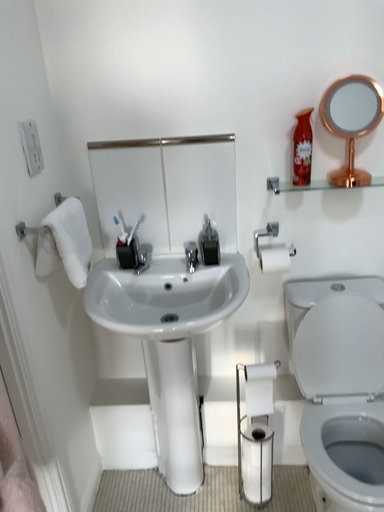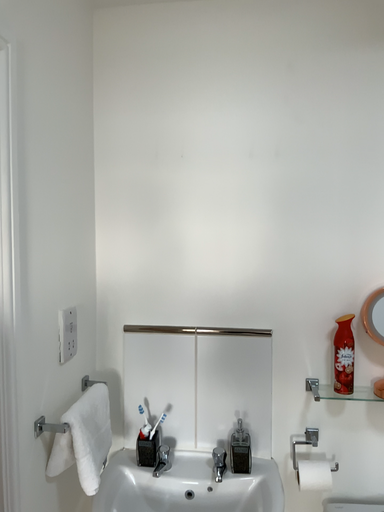
Question: How did the camera likely rotate when shooting the video?

Choices:
 (A) rotated downward
 (B) rotated upward

Answer: (B)